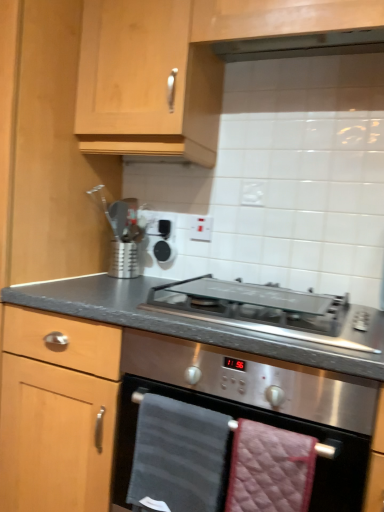
Describe the element at coordinates (270, 469) in the screenshot. I see `quilted pink hand towel at lower center, the 2th hand towel from the left` at that location.

Image resolution: width=384 pixels, height=512 pixels. What do you see at coordinates (262, 422) in the screenshot?
I see `stainless steel oven at center` at bounding box center [262, 422].

What do you see at coordinates (155, 393) in the screenshot? The image size is (384, 512). I see `granite gray countertop at center` at bounding box center [155, 393].

Describe the element at coordinates (124, 260) in the screenshot. I see `satin silver utensil holder at upper center` at that location.

In order to face white plastic electric outlet at upper center, should I rotate leftwards or rightwards?

To align with it, rotate right about 1.225°.

The width and height of the screenshot is (384, 512). Describe the element at coordinates (187, 64) in the screenshot. I see `light wood cabinet at upper center` at that location.

The image size is (384, 512). In order to click on light wood cabinet at upper center in this screenshot , I will do `click(187, 64)`.

The height and width of the screenshot is (512, 384). In order to click on quilted pink hand towel at lower center, the 2th hand towel from the left in this screenshot , I will do `click(270, 469)`.

Does dark gray textured towel at center, acting as the second hand towel starting from the right, appear on the left side of light wood cabinet at upper center?

Correct, you'll find dark gray textured towel at center, acting as the second hand towel starting from the right, to the left of light wood cabinet at upper center.

Which hand towel is the 1st one when counting from the front of the light wood cabinet at upper center? Please provide its 2D coordinates.

[(178, 456)]

From a real-world perspective, is dark gray textured towel at center, acting as the second hand towel starting from the right, physically located above or below light wood cabinet at upper center?

Clearly, from a real-world perspective, dark gray textured towel at center, acting as the second hand towel starting from the right, is below light wood cabinet at upper center.

Can you tell me how much dark gray textured towel at center, positioned as the 1th hand towel in left-to-right order, and light wood cabinet at upper center differ in facing direction?

The facing directions of dark gray textured towel at center, positioned as the 1th hand towel in left-to-right order, and light wood cabinet at upper center are 0.487 degrees apart.

Consider the image. Between quilted pink hand towel at lower center, the 2th hand towel from the left, and dark gray textured towel at center, positioned as the 1th hand towel in left-to-right order, which one appears on the right side from the viewer's perspective?

quilted pink hand towel at lower center, the 2th hand towel from the left, is more to the right.

Locate an element on the screen. The width and height of the screenshot is (384, 512). hand towel below the dark gray textured towel at center, acting as the second hand towel starting from the right (from a real-world perspective) is located at coordinates (270, 469).

Does quilted pink hand towel at lower center, which ranks as the first hand towel in right-to-left order, lie behind dark gray textured towel at center, positioned as the 1th hand towel in left-to-right order?

No, quilted pink hand towel at lower center, which ranks as the first hand towel in right-to-left order, is in front of dark gray textured towel at center, positioned as the 1th hand towel in left-to-right order.

Based on the photo, is dark gray textured towel at center, positioned as the 1th hand towel in left-to-right order, looking in the opposite direction of satin silver glass at center?

That's not correct — dark gray textured towel at center, positioned as the 1th hand towel in left-to-right order, is not looking away from satin silver glass at center.

How different are the orientations of dark gray textured towel at center, positioned as the 1th hand towel in left-to-right order, and satin silver glass at center in degrees?

0.487 degrees separate the facing orientations of dark gray textured towel at center, positioned as the 1th hand towel in left-to-right order, and satin silver glass at center.

From the picture: Considering the relative sizes of dark gray textured towel at center, acting as the second hand towel starting from the right, and satin silver glass at center in the image provided, is dark gray textured towel at center, acting as the second hand towel starting from the right, thinner than satin silver glass at center?

Yes.

Which is less distant, [172,479] or [259,330]?

Point [172,479] is farther from the camera than point [259,330].

Is satin silver glass at center oriented away from satin silver utensil holder at upper center?

satin silver glass at center does not have its back to satin silver utensil holder at upper center.

Considering the positions of point (162, 290) and point (130, 270), is point (162, 290) closer or farther from the camera than point (130, 270)?

Point (162, 290).

Do you think satin silver glass at center is within satin silver utensil holder at upper center, or outside of it?

The correct answer is: outside.

Looking at this image, in the image, is granite gray countertop at center on the left side or the right side of stainless steel oven at center?

Clearly, granite gray countertop at center is on the left of stainless steel oven at center in the image.

Is granite gray countertop at center closer to camera compared to stainless steel oven at center?

Yes, granite gray countertop at center is closer to the viewer.

Is point (235, 407) farther from viewer compared to point (339, 468)?

Yes.

In the scene shown: How different are the orientations of granite gray countertop at center and stainless steel oven at center in degrees?

The angular difference between granite gray countertop at center and stainless steel oven at center is 0.248 degrees.

What's the angular difference between light wood cabinet at upper center and satin silver utensil holder at upper center's facing directions?

There is a 6.49-degree angle between the facing directions of light wood cabinet at upper center and satin silver utensil holder at upper center.

Which is more to the left, light wood cabinet at upper center or satin silver utensil holder at upper center?

From the viewer's perspective, satin silver utensil holder at upper center appears more on the left side.

Considering the positions of point (289, 22) and point (128, 271), is point (289, 22) closer or farther from the camera than point (128, 271)?

Point (289, 22) appears to be closer to the viewer than point (128, 271).

Where is `cabinetry above the satin silver utensil holder at upper center (from a real-world perspective)`? The height and width of the screenshot is (512, 384). cabinetry above the satin silver utensil holder at upper center (from a real-world perspective) is located at coordinates (187, 64).

From the image's perspective, who appears lower, granite gray countertop at center or light wood cabinet at upper center?

From the image's view, granite gray countertop at center is below.

Identify the location of countertop in front of the light wood cabinet at upper center. This screenshot has width=384, height=512. (155, 393).

Based on the photo, which is farther, (66, 424) or (78, 88)?

The point (78, 88) is more distant.

From a real-world perspective, count 1st hand towels downward from the light wood cabinet at upper center and point to it. Please provide its 2D coordinates.

[(178, 456)]

The width and height of the screenshot is (384, 512). I want to click on hand towel that appears in front of the dark gray textured towel at center, acting as the second hand towel starting from the right, so click(x=270, y=469).

From the image, which object appears to be farther from satin silver glass at center, granite gray countertop at center or light wood cabinet at upper center?

Based on the image, light wood cabinet at upper center appears to be further to satin silver glass at center.

Which object lies further to the anchor point satin silver utensil holder at upper center, satin silver glass at center or stainless steel oven at center?

The object further to satin silver utensil holder at upper center is stainless steel oven at center.

Which object lies further to the anchor point satin silver utensil holder at upper center, stainless steel oven at center or granite gray countertop at center?

Among the two, stainless steel oven at center is located further to satin silver utensil holder at upper center.

When comparing their distances from stainless steel oven at center, does satin silver utensil holder at upper center or dark gray textured towel at center, positioned as the 1th hand towel in left-to-right order, seem further?

Among the two, satin silver utensil holder at upper center is located further to stainless steel oven at center.

Looking at this image, when comparing their distances from satin silver utensil holder at upper center, does dark gray textured towel at center, positioned as the 1th hand towel in left-to-right order, or granite gray countertop at center seem further?

dark gray textured towel at center, positioned as the 1th hand towel in left-to-right order, lies further to satin silver utensil holder at upper center than the other object.

Estimate the real-world distances between objects in this image. Which object is closer to satin silver utensil holder at upper center, white plastic electric outlet at upper center or granite gray countertop at center?

The object closer to satin silver utensil holder at upper center is white plastic electric outlet at upper center.

Estimate the real-world distances between objects in this image. Which object is further from satin silver glass at center, white plastic electric outlet at upper center or quilted pink hand towel at lower center, which ranks as the first hand towel in right-to-left order?

The object further to satin silver glass at center is white plastic electric outlet at upper center.

Which object lies further to the anchor point quilted pink hand towel at lower center, the 2th hand towel from the left, stainless steel oven at center or dark gray textured towel at center, acting as the second hand towel starting from the right?

Based on the image, dark gray textured towel at center, acting as the second hand towel starting from the right, appears to be further to quilted pink hand towel at lower center, the 2th hand towel from the left.

At what (x,y) coordinates should I click in order to perform the action: click on oven positioned between granite gray countertop at center and white plastic electric outlet at upper center from near to far. Please return your answer as a coordinate pair (x, y). Image resolution: width=384 pixels, height=512 pixels. Looking at the image, I should click on (262, 422).

This screenshot has width=384, height=512. In order to click on hand towel between satin silver glass at center and white plastic electric outlet at upper center in the front-back direction in this screenshot , I will do (x=178, y=456).

What are the coordinates of `electric outlet between light wood cabinet at upper center and dark gray textured towel at center, acting as the second hand towel starting from the right, from top to bottom` in the screenshot? It's located at (201, 228).

This screenshot has width=384, height=512. Find the location of `hand towel that lies between satin silver glass at center and quilted pink hand towel at lower center, which ranks as the first hand towel in right-to-left order, from top to bottom`. hand towel that lies between satin silver glass at center and quilted pink hand towel at lower center, which ranks as the first hand towel in right-to-left order, from top to bottom is located at coordinates (178, 456).